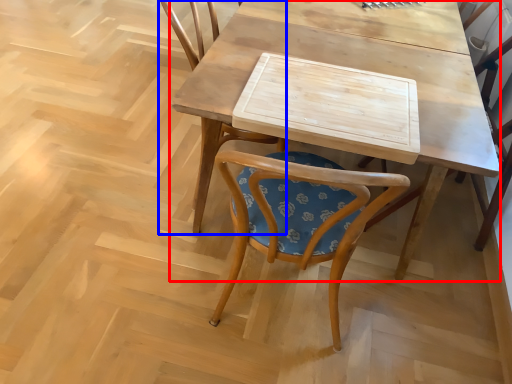
Question: Which object is closer to the camera taking this photo, table (highlighted by a red box) or chair (highlighted by a blue box)?

Choices:
 (A) table
 (B) chair

Answer: (A)